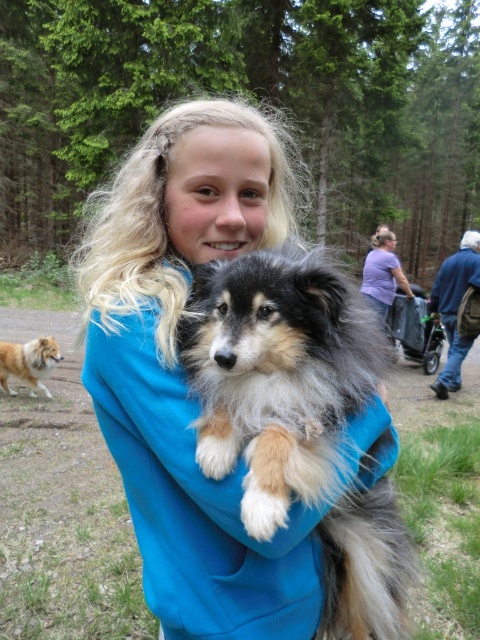
Question: Among these objects, which one is farthest from the camera?

Choices:
 (A) brown fluffy dog at left
 (B) blue soft sweater at center
 (C) fluffy fur dog at center

Answer: (A)

Question: Is blue soft sweater at center below fluffy fur dog at center?

Choices:
 (A) yes
 (B) no

Answer: (A)

Question: Among these points, which one is farthest from the camera?

Choices:
 (A) (374, 486)
 (B) (251, 582)
 (C) (47, 371)

Answer: (C)

Question: Observing the image, what is the correct spatial positioning of blue soft sweater at center in reference to fluffy fur dog at center?

Choices:
 (A) above
 (B) below

Answer: (B)

Question: Does blue soft sweater at center appear over brown fluffy dog at left?

Choices:
 (A) no
 (B) yes

Answer: (B)

Question: Among these objects, which one is farthest from the camera?

Choices:
 (A) blue soft sweater at center
 (B) brown fluffy dog at left
 (C) fluffy fur dog at center

Answer: (B)